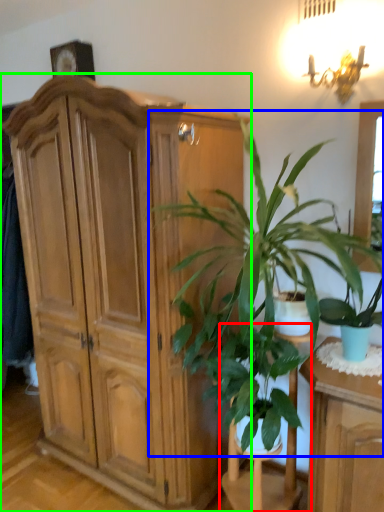
Question: Estimate the real-world distances between objects in this image. Which object is farther from armchair (highlighted by a red box), houseplant (highlighted by a blue box) or cabinetry (highlighted by a green box)?

Choices:
 (A) houseplant
 (B) cabinetry

Answer: (B)